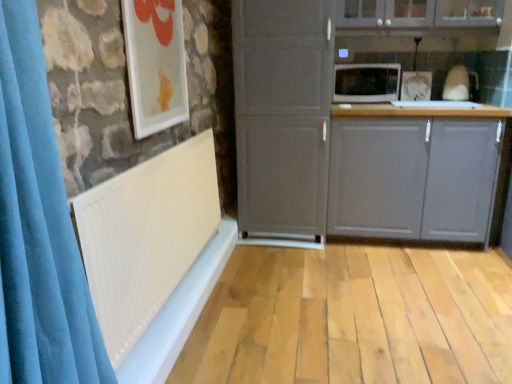
Question: In terms of size, does white glossy picture frame at upper left appear bigger or smaller than white matte radiator at left?

Choices:
 (A) big
 (B) small

Answer: (B)

Question: From a real-world perspective, relative to white matte radiator at left, is white glossy picture frame at upper left vertically above or below?

Choices:
 (A) above
 (B) below

Answer: (A)

Question: Which object is the closest to the white matte radiator at left?

Choices:
 (A) matte gray cupboard at center
 (B) white glossy picture frame at upper left
 (C) velvet blue shower curtain at left
 (D) matte gray cabinet at upper center, marked as the 2th cabinetry in a bottom-to-top arrangement
 (E) white glossy microwave at upper center

Answer: (B)

Question: Estimate the real-world distances between objects in this image. Which object is closer to the white matte radiator at left?

Choices:
 (A) matte gray cabinet at upper center, marked as the 2th cabinetry in a bottom-to-top arrangement
 (B) matte gray cabinet at center, which is the second cabinetry from top to bottom
 (C) matte gray cupboard at center
 (D) white glossy microwave at upper center
 (E) velvet blue shower curtain at left

Answer: (E)